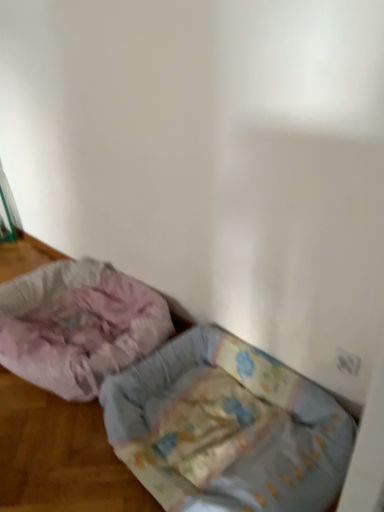
Where is `fluffy fabric dog bed at lower left, the 2th dog bed when ordered from left to right`? This screenshot has width=384, height=512. fluffy fabric dog bed at lower left, the 2th dog bed when ordered from left to right is located at coordinates (227, 428).

This screenshot has height=512, width=384. What do you see at coordinates (227, 428) in the screenshot?
I see `fluffy fabric dog bed at lower left, positioned as the first dog bed in right-to-left order` at bounding box center [227, 428].

This screenshot has height=512, width=384. Describe the element at coordinates (78, 325) in the screenshot. I see `fluffy pink fabric dog bed at lower left, the 1th dog bed viewed from the left` at that location.

How much space does fluffy pink fabric dog bed at lower left, the 1th dog bed viewed from the left, occupy horizontally?

29.11 inches.

Find the location of a particular element. The width and height of the screenshot is (384, 512). fluffy pink fabric dog bed at lower left, placed as the 2th dog bed when sorted from right to left is located at coordinates (78, 325).

This screenshot has height=512, width=384. In order to click on fluffy fabric dog bed at lower left, the 2th dog bed when ordered from left to right in this screenshot , I will do `click(227, 428)`.

Based on their positions, is fluffy pink fabric dog bed at lower left, placed as the 2th dog bed when sorted from right to left, located to the left or right of fluffy fabric dog bed at lower left, the 2th dog bed when ordered from left to right?

From the image, it's evident that fluffy pink fabric dog bed at lower left, placed as the 2th dog bed when sorted from right to left, is to the left of fluffy fabric dog bed at lower left, the 2th dog bed when ordered from left to right.

Relative to fluffy fabric dog bed at lower left, positioned as the first dog bed in right-to-left order, is fluffy pink fabric dog bed at lower left, the 1th dog bed viewed from the left, in front or behind?

In the image, fluffy pink fabric dog bed at lower left, the 1th dog bed viewed from the left, appears behind fluffy fabric dog bed at lower left, positioned as the first dog bed in right-to-left order.

Is point (49, 311) more distant than point (190, 424)?

Yes, point (49, 311) is behind point (190, 424).

From the image's perspective, is fluffy pink fabric dog bed at lower left, the 1th dog bed viewed from the left, above or below fluffy fabric dog bed at lower left, the 2th dog bed when ordered from left to right?

fluffy pink fabric dog bed at lower left, the 1th dog bed viewed from the left, is above fluffy fabric dog bed at lower left, the 2th dog bed when ordered from left to right.

From a real-world perspective, is fluffy pink fabric dog bed at lower left, placed as the 2th dog bed when sorted from right to left, above or below fluffy fabric dog bed at lower left, the 2th dog bed when ordered from left to right?

fluffy pink fabric dog bed at lower left, placed as the 2th dog bed when sorted from right to left, is situated higher than fluffy fabric dog bed at lower left, the 2th dog bed when ordered from left to right, in the real world.

Considering the sizes of objects fluffy pink fabric dog bed at lower left, placed as the 2th dog bed when sorted from right to left, and fluffy fabric dog bed at lower left, the 2th dog bed when ordered from left to right, in the image provided, who is wider, fluffy pink fabric dog bed at lower left, placed as the 2th dog bed when sorted from right to left, or fluffy fabric dog bed at lower left, the 2th dog bed when ordered from left to right,?

fluffy pink fabric dog bed at lower left, placed as the 2th dog bed when sorted from right to left, is wider.

Does fluffy pink fabric dog bed at lower left, placed as the 2th dog bed when sorted from right to left, have a lesser height compared to fluffy fabric dog bed at lower left, the 2th dog bed when ordered from left to right?

No, fluffy pink fabric dog bed at lower left, placed as the 2th dog bed when sorted from right to left, is not shorter than fluffy fabric dog bed at lower left, the 2th dog bed when ordered from left to right.

Is fluffy pink fabric dog bed at lower left, the 1th dog bed viewed from the left, smaller than fluffy fabric dog bed at lower left, the 2th dog bed when ordered from left to right?

No, fluffy pink fabric dog bed at lower left, the 1th dog bed viewed from the left, is not smaller than fluffy fabric dog bed at lower left, the 2th dog bed when ordered from left to right.

Is fluffy pink fabric dog bed at lower left, the 1th dog bed viewed from the left, inside or outside of fluffy fabric dog bed at lower left, the 2th dog bed when ordered from left to right?

fluffy pink fabric dog bed at lower left, the 1th dog bed viewed from the left, is located beyond the bounds of fluffy fabric dog bed at lower left, the 2th dog bed when ordered from left to right.

Looking at this image, are fluffy pink fabric dog bed at lower left, placed as the 2th dog bed when sorted from right to left, and fluffy fabric dog bed at lower left, the 2th dog bed when ordered from left to right, located far from each other?

fluffy pink fabric dog bed at lower left, placed as the 2th dog bed when sorted from right to left, is actually quite close to fluffy fabric dog bed at lower left, the 2th dog bed when ordered from left to right.

Is fluffy pink fabric dog bed at lower left, the 1th dog bed viewed from the left, turned away from fluffy fabric dog bed at lower left, the 2th dog bed when ordered from left to right?

fluffy pink fabric dog bed at lower left, the 1th dog bed viewed from the left, is not turned away from fluffy fabric dog bed at lower left, the 2th dog bed when ordered from left to right.

Where is `dog bed on the right side of fluffy pink fabric dog bed at lower left, placed as the 2th dog bed when sorted from right to left`? dog bed on the right side of fluffy pink fabric dog bed at lower left, placed as the 2th dog bed when sorted from right to left is located at coordinates (227, 428).

Which object is positioned more to the left, fluffy fabric dog bed at lower left, the 2th dog bed when ordered from left to right, or fluffy pink fabric dog bed at lower left, the 1th dog bed viewed from the left?

From the viewer's perspective, fluffy pink fabric dog bed at lower left, the 1th dog bed viewed from the left, appears more on the left side.

Which object is further away from the camera, fluffy fabric dog bed at lower left, the 2th dog bed when ordered from left to right, or fluffy pink fabric dog bed at lower left, placed as the 2th dog bed when sorted from right to left?

Positioned behind is fluffy pink fabric dog bed at lower left, placed as the 2th dog bed when sorted from right to left.

Between point (271, 377) and point (155, 296), which one is positioned in front?

The point (271, 377) is closer to the camera.

From the image's perspective, between fluffy fabric dog bed at lower left, the 2th dog bed when ordered from left to right, and fluffy pink fabric dog bed at lower left, placed as the 2th dog bed when sorted from right to left, which one is located above?

fluffy pink fabric dog bed at lower left, placed as the 2th dog bed when sorted from right to left.

From a real-world perspective, relative to fluffy pink fabric dog bed at lower left, the 1th dog bed viewed from the left, is fluffy fabric dog bed at lower left, positioned as the first dog bed in right-to-left order, vertically above or below?

fluffy fabric dog bed at lower left, positioned as the first dog bed in right-to-left order, is below fluffy pink fabric dog bed at lower left, the 1th dog bed viewed from the left.

Considering the sizes of objects fluffy fabric dog bed at lower left, positioned as the first dog bed in right-to-left order, and fluffy pink fabric dog bed at lower left, the 1th dog bed viewed from the left, in the image provided, who is thinner, fluffy fabric dog bed at lower left, positioned as the first dog bed in right-to-left order, or fluffy pink fabric dog bed at lower left, the 1th dog bed viewed from the left,?

Thinner between the two is fluffy fabric dog bed at lower left, positioned as the first dog bed in right-to-left order.

Does fluffy fabric dog bed at lower left, positioned as the first dog bed in right-to-left order, have a greater height compared to fluffy pink fabric dog bed at lower left, placed as the 2th dog bed when sorted from right to left?

In fact, fluffy fabric dog bed at lower left, positioned as the first dog bed in right-to-left order, may be shorter than fluffy pink fabric dog bed at lower left, placed as the 2th dog bed when sorted from right to left.

Between fluffy fabric dog bed at lower left, the 2th dog bed when ordered from left to right, and fluffy pink fabric dog bed at lower left, the 1th dog bed viewed from the left, which one has larger size?

fluffy pink fabric dog bed at lower left, the 1th dog bed viewed from the left.

Can we say fluffy fabric dog bed at lower left, positioned as the first dog bed in right-to-left order, lies outside fluffy pink fabric dog bed at lower left, the 1th dog bed viewed from the left?

fluffy fabric dog bed at lower left, positioned as the first dog bed in right-to-left order, is positioned outside fluffy pink fabric dog bed at lower left, the 1th dog bed viewed from the left.

Is fluffy fabric dog bed at lower left, positioned as the first dog bed in right-to-left order, not close to fluffy pink fabric dog bed at lower left, the 1th dog bed viewed from the left?

No, fluffy fabric dog bed at lower left, positioned as the first dog bed in right-to-left order, is not far from fluffy pink fabric dog bed at lower left, the 1th dog bed viewed from the left.

Is fluffy fabric dog bed at lower left, positioned as the first dog bed in right-to-left order, positioned with its back to fluffy pink fabric dog bed at lower left, placed as the 2th dog bed when sorted from right to left?

No, fluffy fabric dog bed at lower left, positioned as the first dog bed in right-to-left order,'s orientation is not away from fluffy pink fabric dog bed at lower left, placed as the 2th dog bed when sorted from right to left.

Measure the distance from fluffy fabric dog bed at lower left, positioned as the first dog bed in right-to-left order, to fluffy pink fabric dog bed at lower left, placed as the 2th dog bed when sorted from right to left.

17.30 inches.

Where is `dog bed lying on the left of fluffy fabric dog bed at lower left, the 2th dog bed when ordered from left to right`? The width and height of the screenshot is (384, 512). dog bed lying on the left of fluffy fabric dog bed at lower left, the 2th dog bed when ordered from left to right is located at coordinates [x=78, y=325].

You are a GUI agent. You are given a task and a screenshot of the screen. Output one action in this format:
    pyautogui.click(x=<x>, y=<y>)
    Task: Click on the dog bed on the left of fluffy fabric dog bed at lower left, the 2th dog bed when ordered from left to right
    Image resolution: width=384 pixels, height=512 pixels.
    Given the screenshot: What is the action you would take?
    pyautogui.click(x=78, y=325)

Where is `dog bed in front of the fluffy pink fabric dog bed at lower left, the 1th dog bed viewed from the left`? The width and height of the screenshot is (384, 512). dog bed in front of the fluffy pink fabric dog bed at lower left, the 1th dog bed viewed from the left is located at coordinates (227, 428).